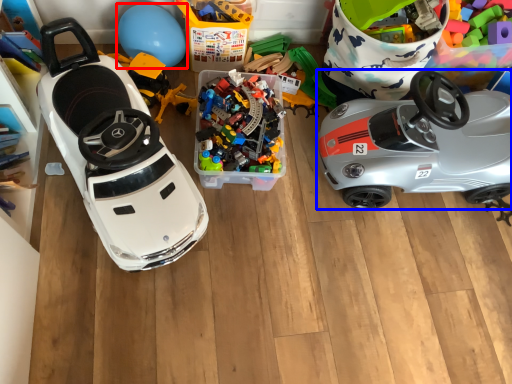
Question: Which object is further to the camera taking this photo, balloon (highlighted by a red box) or car (highlighted by a blue box)?

Choices:
 (A) balloon
 (B) car

Answer: (A)